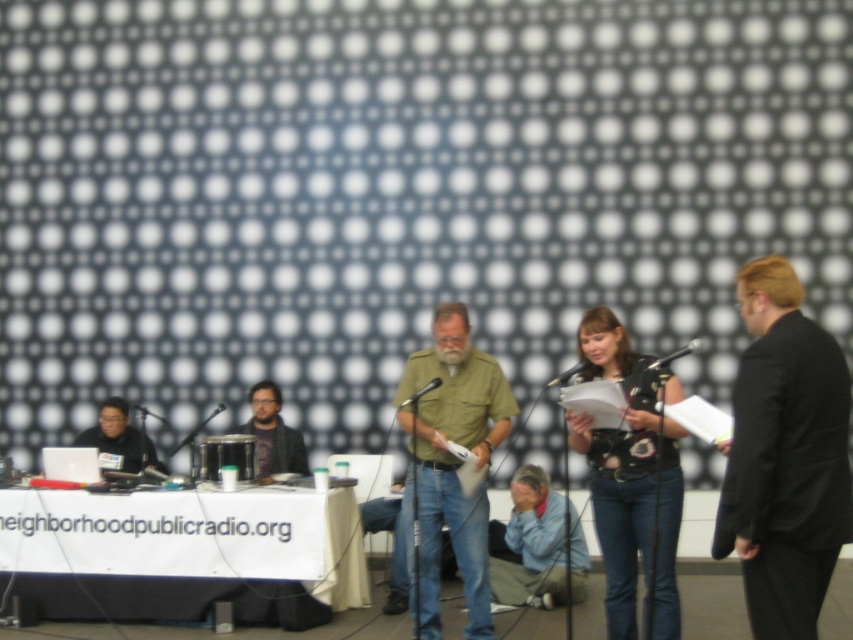
From the picture: You are setting up equipment for a live broadcast. You have a white fabric table at lower left and a black plastic microphone at center. Which object is taller?

The white fabric table at lower left is taller than the black plastic microphone at center according to the description.

Looking at this image, you are a photographer taking a picture of the scene. You want to focus on the black floral shirt at center and the light blue denim jeans at lower center. Which one is on the right side when looking at the scene?

The black floral shirt at center is positioned on the right side of light blue denim jeans at lower center, so when looking at the scene, the black floral shirt at center is on the right side relative to the light blue denim jeans at lower center.

Looking at this image, you are organizing a community event and need to ensure that all participants can see the materials on the table. Considering the black floral shirt at center and the light blue denim jeans at lower center, which item takes up more space in the foreground?

The black floral shirt at center takes up more space in the foreground compared to the light blue denim jeans at lower center because it has a larger size.